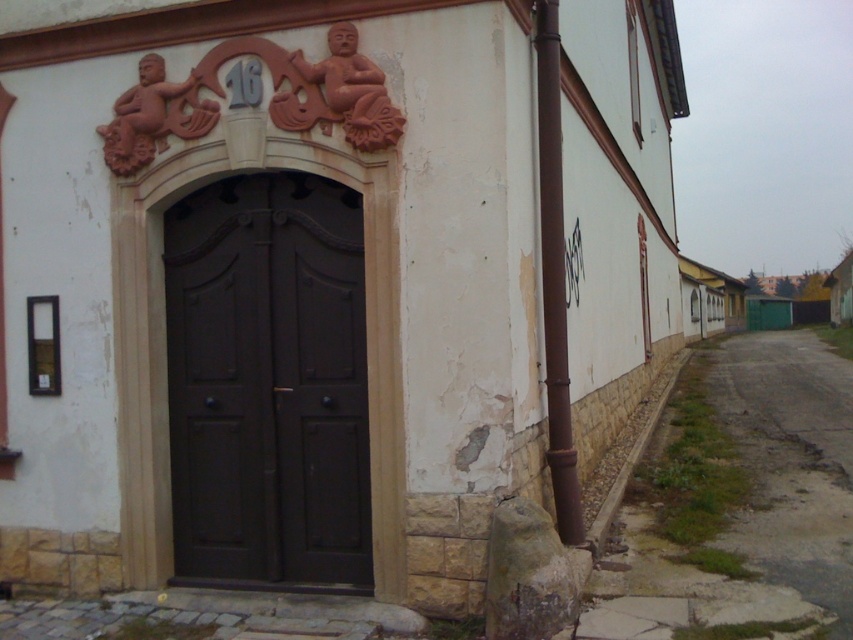
You are standing in front of the building entrance and need to locate the brown metallic pipe at right. Based on the coordinates provided, where should you look relative to the entrance?

The brown metallic pipe at right is located at coordinates point (554, 278), which means it is positioned to the right and slightly above the entrance area.

You are a painter hired to paint the matte dark brown door at center and the brown metallic pipe at right. You need to know which object requires a taller ladder. Based on the scene, which one needs a taller ladder?

The brown metallic pipe at right needs a taller ladder because it is taller than the matte dark brown door at center.